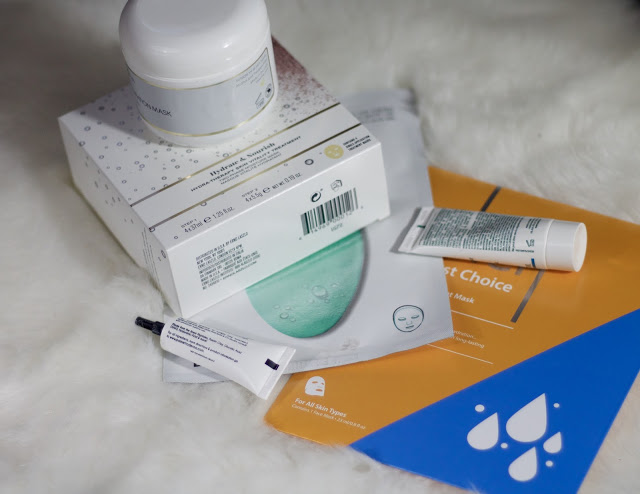
Where is `furry bath mat`? This screenshot has width=640, height=494. furry bath mat is located at coordinates (56, 373).